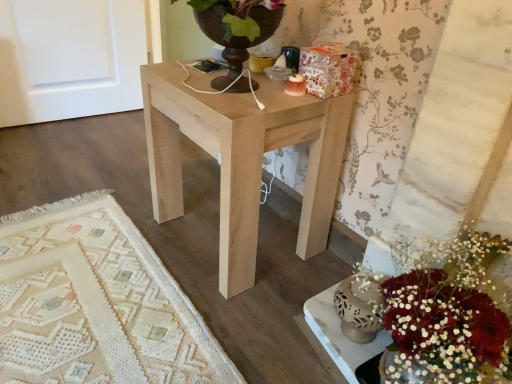
Question: From a real-world perspective, is white matte vase at lower right below natural wood table at center?

Choices:
 (A) no
 (B) yes

Answer: (B)

Question: Is white matte vase at lower right next to natural wood table at center?

Choices:
 (A) no
 (B) yes

Answer: (A)

Question: Is white matte vase at lower right positioned behind natural wood table at center?

Choices:
 (A) yes
 (B) no

Answer: (B)

Question: From the image's perspective, is white matte vase at lower right below natural wood table at center?

Choices:
 (A) no
 (B) yes

Answer: (B)

Question: Does white matte vase at lower right have a lesser width compared to natural wood table at center?

Choices:
 (A) no
 (B) yes

Answer: (B)

Question: Can you confirm if white matte vase at lower right is bigger than natural wood table at center?

Choices:
 (A) no
 (B) yes

Answer: (A)

Question: Is natural wood table at center behind white matte vase at lower right?

Choices:
 (A) no
 (B) yes

Answer: (B)

Question: From a real-world perspective, is natural wood table at center on top of white matte vase at lower right?

Choices:
 (A) yes
 (B) no

Answer: (A)

Question: Is natural wood table at center facing towards white matte vase at lower right?

Choices:
 (A) yes
 (B) no

Answer: (B)

Question: Can you confirm if natural wood table at center is smaller than white matte vase at lower right?

Choices:
 (A) no
 (B) yes

Answer: (A)

Question: Is white matte vase at lower right a part of natural wood table at center?

Choices:
 (A) no
 (B) yes

Answer: (A)

Question: Is white matte vase at lower right at the back of natural wood table at center?

Choices:
 (A) no
 (B) yes

Answer: (A)

Question: Relative to natural wood table at center, is white matte vase at lower right in front or behind?

Choices:
 (A) behind
 (B) front

Answer: (B)